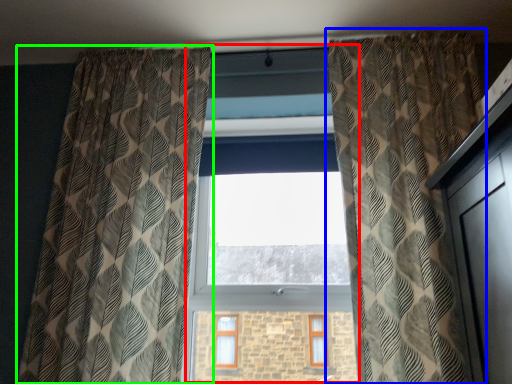
Question: Considering the real-world distances, which object is closest to bay window (highlighted by a red box)? curtain (highlighted by a blue box) or curtain (highlighted by a green box).

Choices:
 (A) curtain
 (B) curtain

Answer: (B)